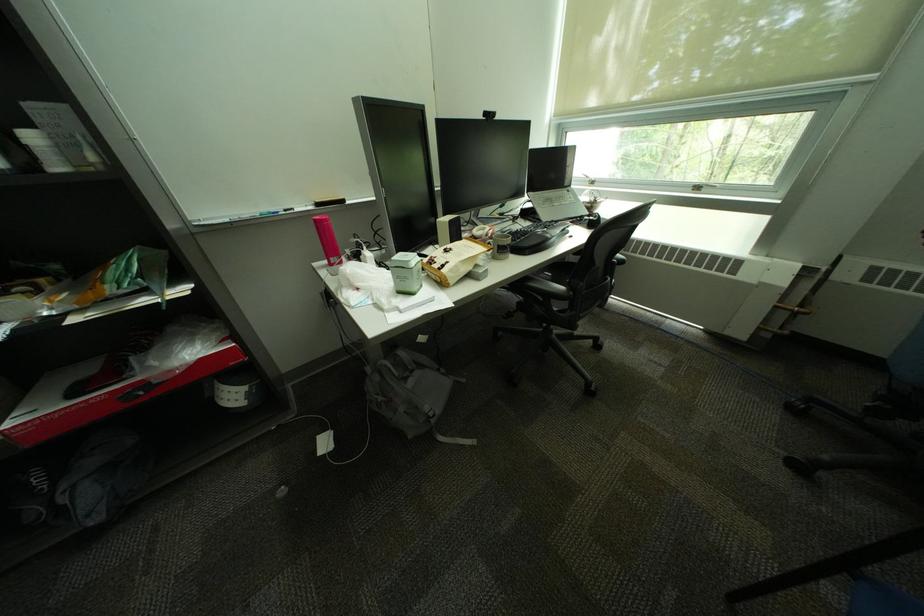
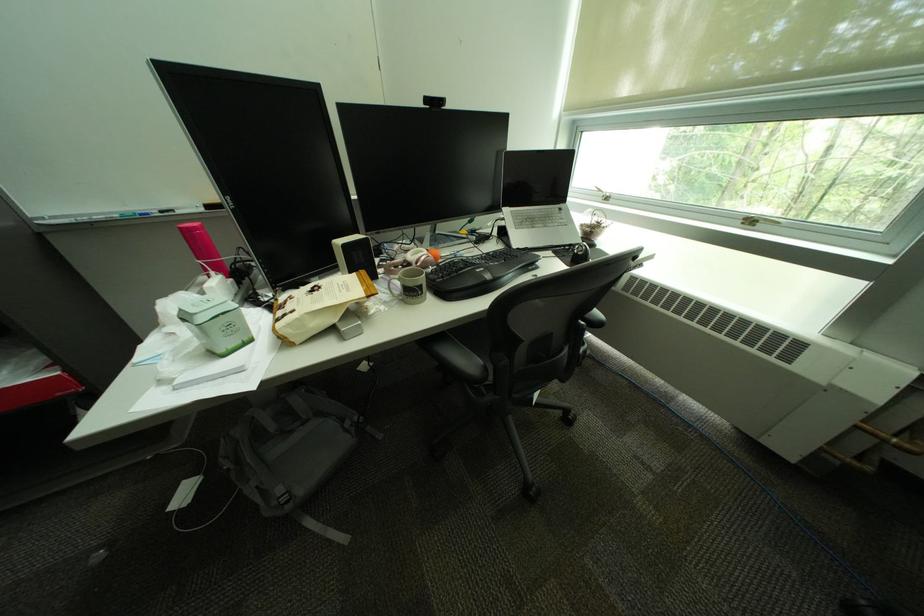
Find the pixel in the second image that matches (541,200) in the first image.

(514, 217)